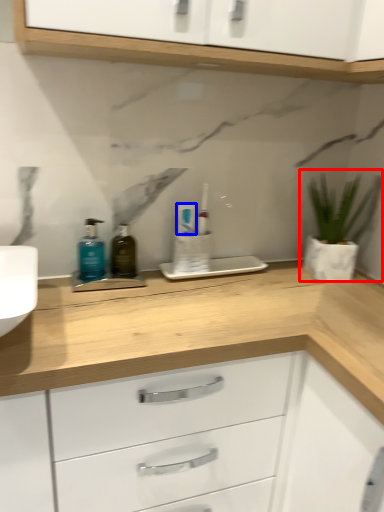
Question: Which object appears closest to the camera in this image, houseplant (highlighted by a red box) or toothpaste (highlighted by a blue box)?

Choices:
 (A) houseplant
 (B) toothpaste

Answer: (A)